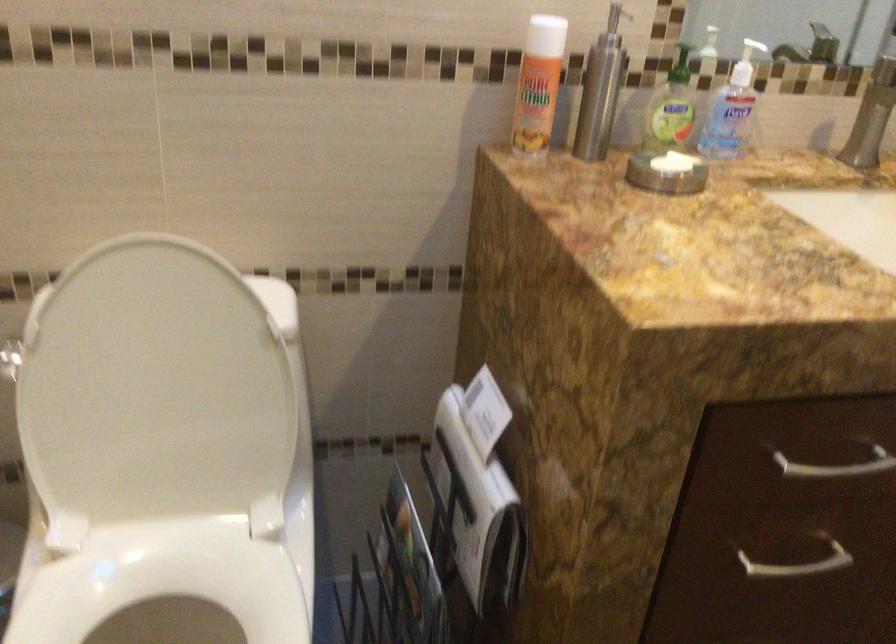
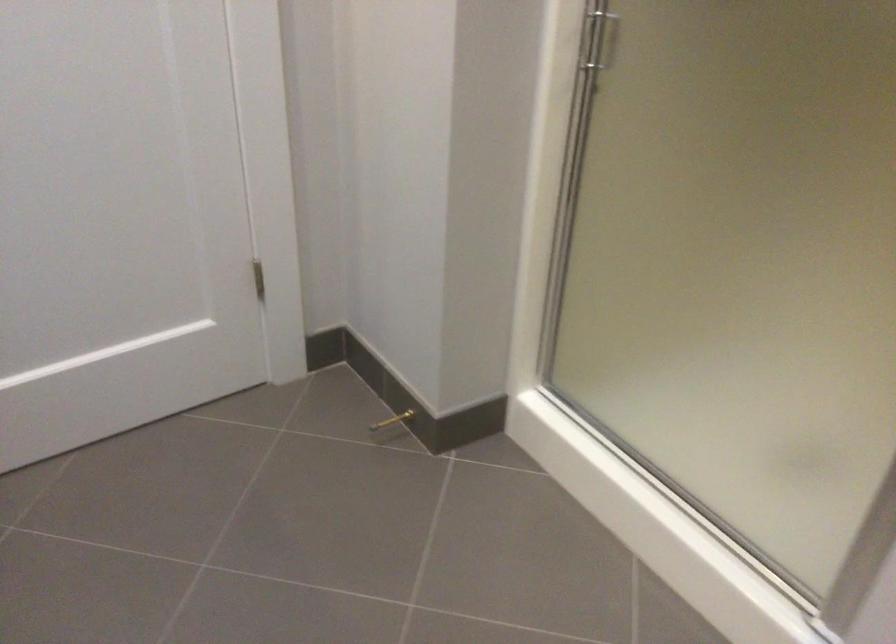
First-person continuous shooting, in which direction is the camera rotating?

The camera's rotation is toward right-down.